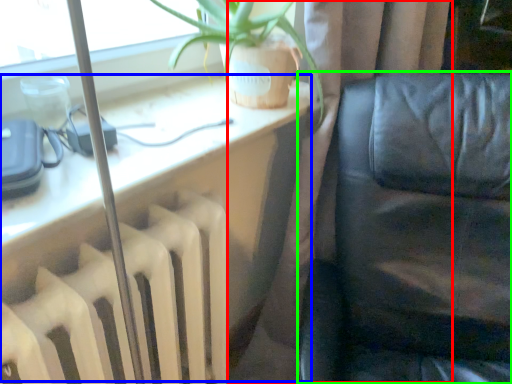
Question: Estimate the real-world distances between objects in this image. Which object is farther from curtain (highlighted by a red box), computer desk (highlighted by a blue box) or furniture (highlighted by a green box)?

Choices:
 (A) computer desk
 (B) furniture

Answer: (A)